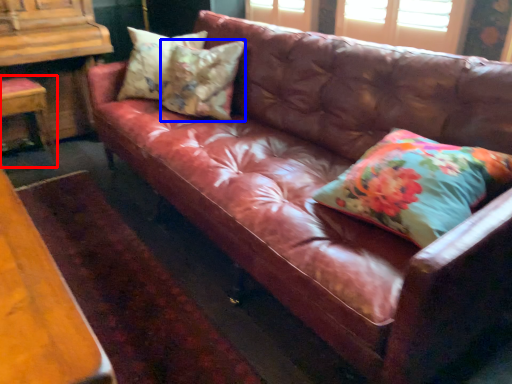
Question: Which of the following is the farthest to the observer, chair (highlighted by a red box) or pillow (highlighted by a blue box)?

Choices:
 (A) chair
 (B) pillow

Answer: (A)